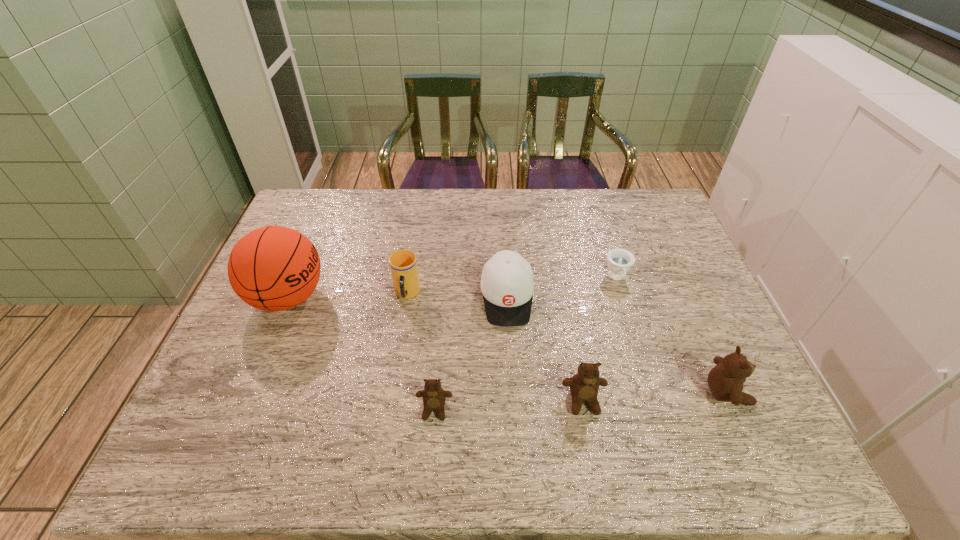
At what (x,y) coordinates should I click in order to perform the action: click on free space that is in between the sixth object from right to left and the baseball cap. Please return your answer as a coordinate pair (x, y). Looking at the image, I should click on (457, 296).

At what (x,y) coordinates should I click in order to perform the action: click on empty space between the leftmost object and the shortest object. Please return your answer as a coordinate pair (x, y). Looking at the image, I should click on (453, 288).

The image size is (960, 540). In order to click on free space between the second shortest object and the leftmost object in this screenshot , I will do `click(362, 353)`.

At what (x,y) coordinates should I click in order to perform the action: click on object that is the third closest to the tallest teddy bear. Please return your answer as a coordinate pair (x, y). This screenshot has height=540, width=960. Looking at the image, I should click on (507, 284).

Select which object is the closest to the sixth object from right to left. Please provide its 2D coordinates. Your answer should be formatted as a tuple, i.e. [(x, y)], where the tuple contains the x and y coordinates of a point satisfying the conditions above.

[(507, 284)]

The image size is (960, 540). Find the location of `the third closest teddy bear relative to the cup`. the third closest teddy bear relative to the cup is located at coordinates click(725, 380).

The height and width of the screenshot is (540, 960). In order to click on teddy bear that is the second nearest to the second teddy bear from left to right in this screenshot , I will do `click(434, 397)`.